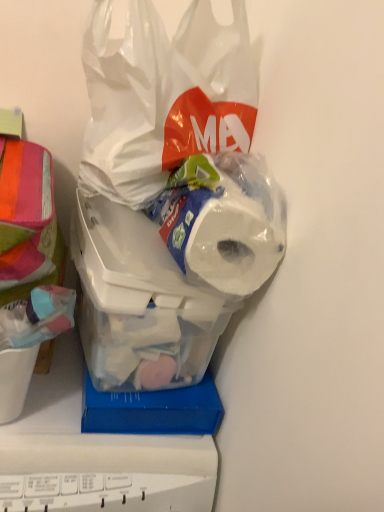
Question: Considering the relative positions of transparent plastic bag at upper center and translucent plastic container at center in the image provided, is transparent plastic bag at upper center to the left or to the right of translucent plastic container at center?

Choices:
 (A) right
 (B) left

Answer: (A)

Question: From a real-world perspective, is transparent plastic bag at upper center above or below translucent plastic container at center?

Choices:
 (A) above
 (B) below

Answer: (A)

Question: Which of these objects is positioned farthest from the transparent plastic bag at upper center?

Choices:
 (A) white matte toilet paper at center
 (B) translucent plastic container at center
 (C) multicolored fabric at left

Answer: (C)

Question: Which object is positioned farthest from the multicolored fabric at left?

Choices:
 (A) white matte toilet paper at center
 (B) translucent plastic container at center
 (C) transparent plastic bag at upper center

Answer: (A)